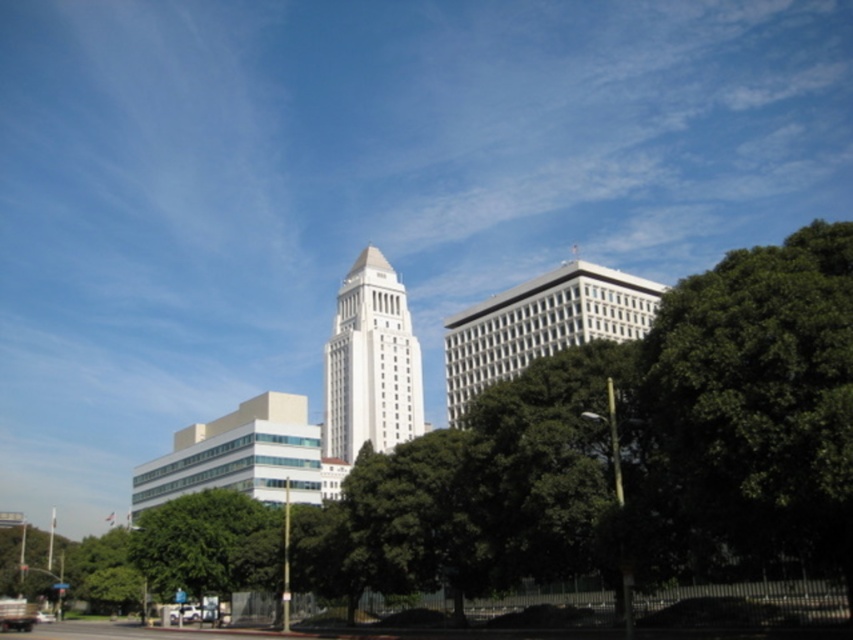
Is green leafy tree at right positioned in front of white glass building at center?

Yes, green leafy tree at right is in front of white glass building at center.

How distant is green leafy tree at right from white glass building at center?

green leafy tree at right is 34.49 meters from white glass building at center.

At what (x,y) coordinates should I click in order to perform the action: click on green leafy tree at right. Please return your answer as a coordinate pair (x, y). This screenshot has width=853, height=640. Looking at the image, I should click on (761, 396).

Identify the location of green leafy tree at right. The image size is (853, 640). (761, 396).

Can you confirm if green leafy tree at center is bigger than green leafy tree at lower left?

Correct, green leafy tree at center is larger in size than green leafy tree at lower left.

Is green leafy tree at center to the right of green leafy tree at lower left from the viewer's perspective?

Correct, you'll find green leafy tree at center to the right of green leafy tree at lower left.

Is point (77, 547) positioned before point (245, 550)?

No, (77, 547) is further to viewer.

In order to click on green leafy tree at center in this screenshot , I will do tap(630, 451).

Is point (386, 282) closer to viewer compared to point (225, 561)?

No, (386, 282) is further to viewer.

Can you confirm if white smooth tower at center is shorter than green leafy tree at lower left?

No, white smooth tower at center is not shorter than green leafy tree at lower left.

Is point (378, 428) positioned in front of point (244, 561)?

No, it is not.

Where is `white smooth tower at center`? This screenshot has height=640, width=853. white smooth tower at center is located at coordinates (370, 364).